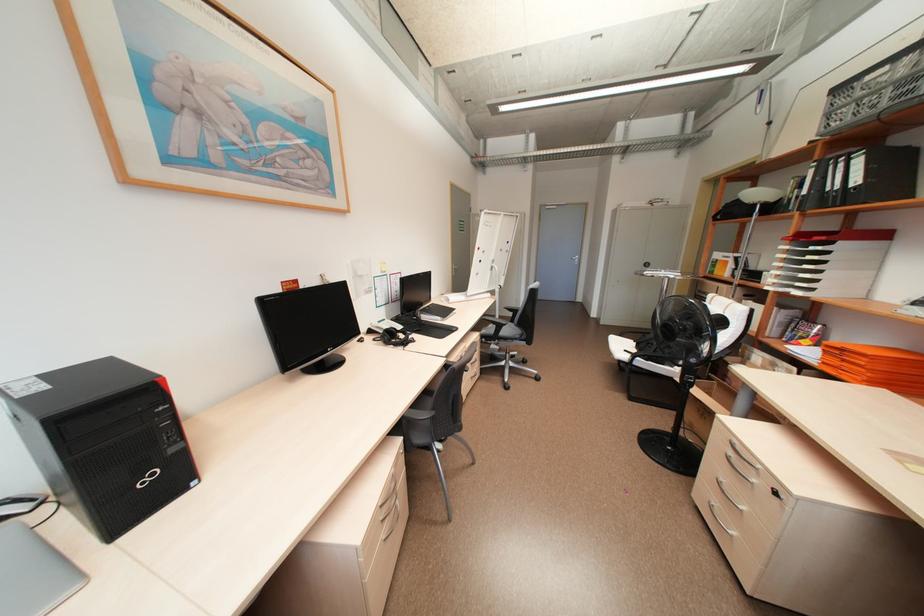
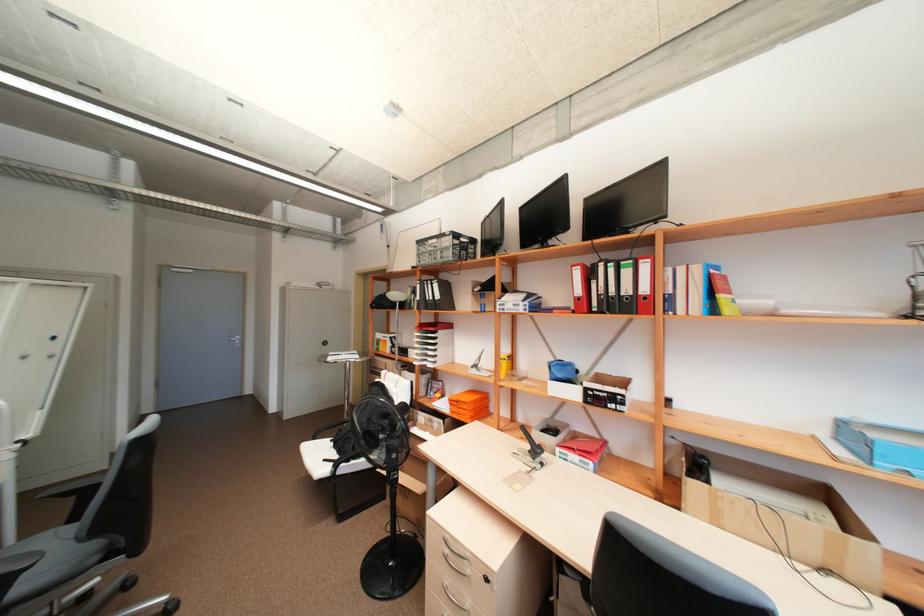
In the second image, find the point that corresponds to the point at 847,350 in the first image.

(463, 400)